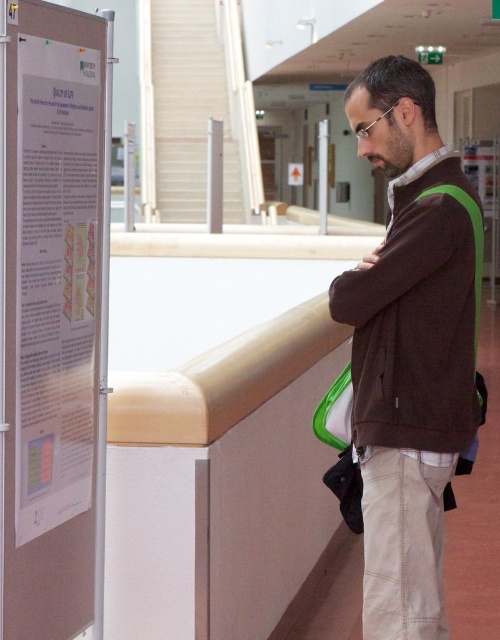
You are standing at the camera position and want to pick up the brown fleece jacket at center. Is it within arm reach?

The brown fleece jacket at center is 7.44 feet away from the camera, which is beyond typical arm reach. You would need to move closer to pick it up.